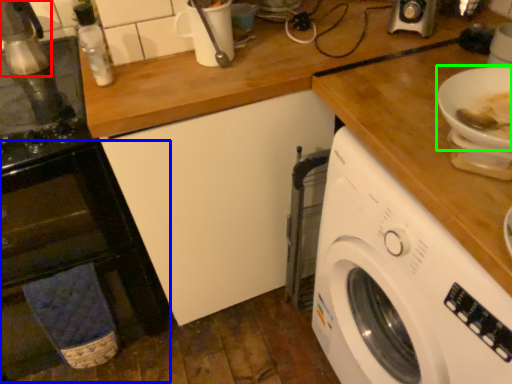
Question: Which object is the closest to the appliance (highlighted by a red box)? Choose among these: oven (highlighted by a blue box) or bowl (highlighted by a green box).

Choices:
 (A) oven
 (B) bowl

Answer: (A)